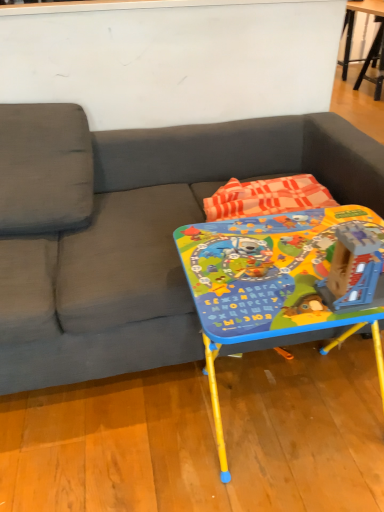
Question: Visually, is matte plastic table at center, marked as the 2th table in a top-to-bottom arrangement, positioned to the left or to the right of gray fabric couch at center?

Choices:
 (A) left
 (B) right

Answer: (B)

Question: Is matte plastic table at center, which is the second table in back-to-front order, situated inside gray fabric couch at center or outside?

Choices:
 (A) outside
 (B) inside

Answer: (A)

Question: Estimate the real-world distances between objects in this image. Which object is farther from the wooden table at upper right, which ranks as the 2th table in left-to-right order?

Choices:
 (A) gray fabric couch at center
 (B) plastic blue building at center
 (C) matte plastic table at center, the first table in the left-to-right sequence

Answer: (B)

Question: Which object is positioned closest to the matte plastic table at center, which is the second table in back-to-front order?

Choices:
 (A) wooden table at upper right, the second table when ordered from front to back
 (B) gray fabric couch at center
 (C) plastic blue building at center

Answer: (C)